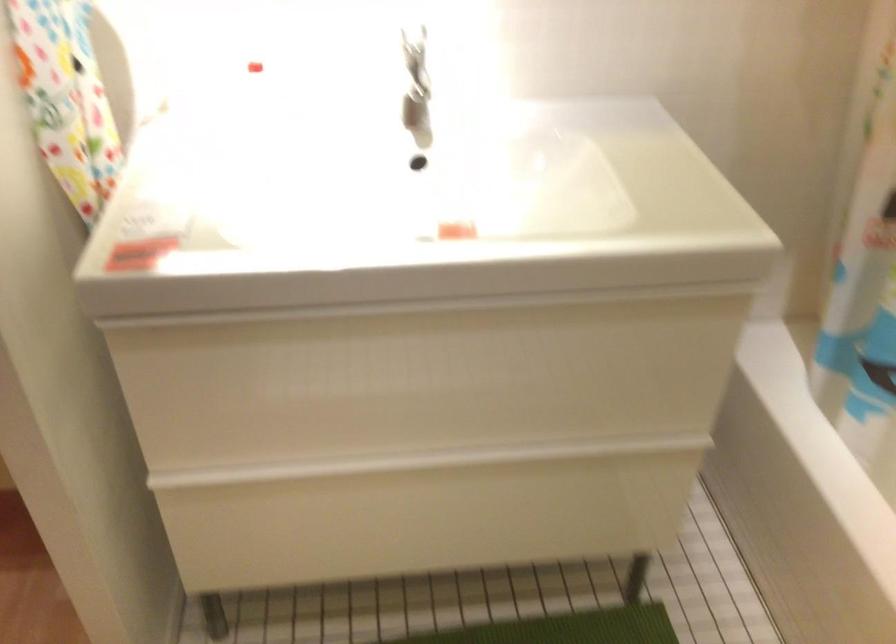
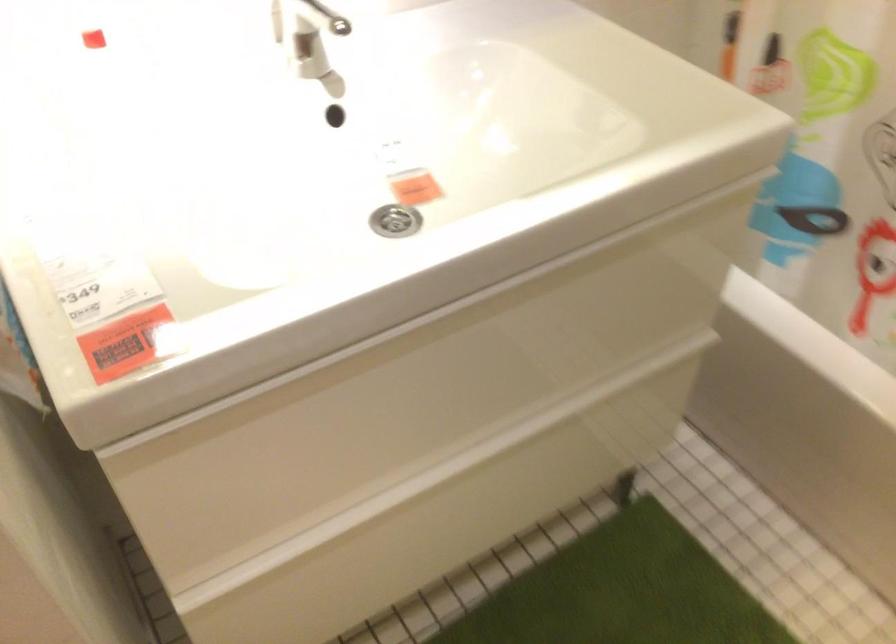
In the second image, find the point that corresponds to point (433, 249) in the first image.

(394, 221)